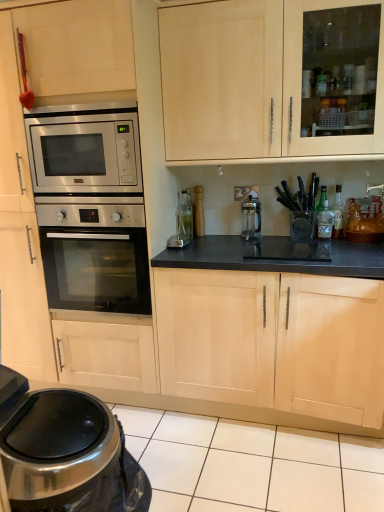
I want to click on free space to the left of clear glass bottle at center-right, acting as the second bottle starting from the right, so click(x=302, y=234).